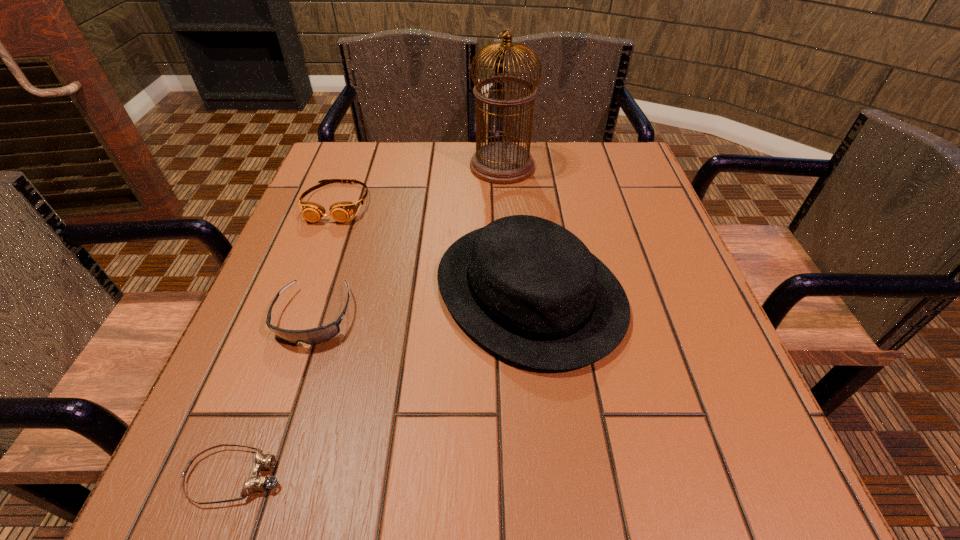
What are the coordinates of `free space located with the lenses facing forward on the farthest goggles` in the screenshot? It's located at pos(306,284).

Find the location of a particular element. The image size is (960, 540). vacant space located 0.220m on the lenses of the second farthest goggles is located at coordinates (258, 485).

At what (x,y) coordinates should I click in order to perform the action: click on vacant space located 0.170m on the front lenses and sides of the nearest object. Please return your answer as a coordinate pair (x, y). Image resolution: width=960 pixels, height=540 pixels. Looking at the image, I should click on (408, 476).

I want to click on birdcage situated at the far edge, so click(501, 162).

The image size is (960, 540). What are the coordinates of `goggles that is positioned at the far edge` in the screenshot? It's located at (341, 211).

Locate an element on the screen. object at the near edge is located at coordinates pyautogui.click(x=255, y=483).

This screenshot has width=960, height=540. Identify the location of object present at the right edge. (529, 290).

Identify the location of object that is positioned at the far left corner. The image size is (960, 540). (341, 211).

I want to click on object that is positioned at the near left corner, so click(x=255, y=483).

In the image, there is a desktop. In order to click on vacant space at the far edge in this screenshot , I will do `click(491, 184)`.